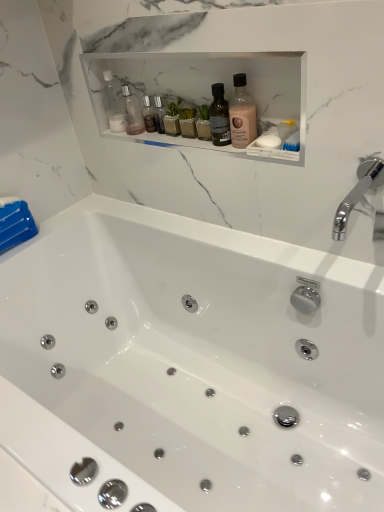
Where is `pink matte bottle at center, the 1th bottle viewed from the front`? The width and height of the screenshot is (384, 512). pink matte bottle at center, the 1th bottle viewed from the front is located at coordinates (242, 114).

Describe the element at coordinates (113, 104) in the screenshot. I see `transparent plastic bottle at upper center, acting as the first bottle starting from the left` at that location.

The height and width of the screenshot is (512, 384). In order to click on white matte soap at right in this screenshot , I will do `click(268, 141)`.

The height and width of the screenshot is (512, 384). I want to click on white glossy bathtub at center, so click(190, 366).

The image size is (384, 512). Identify the location of pink matte bottle at center, the first bottle in the right-to-left sequence. (242, 114).

From the image's perspective, does white matte soap at right appear lower than white glossy bathtub at center?

No, from the image's perspective, white matte soap at right is not beneath white glossy bathtub at center.

Does white matte soap at right have a greater height compared to white glossy bathtub at center?

Incorrect, the height of white matte soap at right is not larger of that of white glossy bathtub at center.

Considering the positions of objects white matte soap at right and white glossy bathtub at center in the image provided, who is more to the right, white matte soap at right or white glossy bathtub at center?

From the viewer's perspective, white matte soap at right appears more on the right side.

Is white matte soap at right wider or thinner than white glossy bathtub at center?

Considering their sizes, white matte soap at right looks slimmer than white glossy bathtub at center.

From the image's perspective, which one is positioned higher, white matte soap at right or transparent plastic bottle at upper center, which ranks as the 3th bottle in right-to-left order?

From the image's view, transparent plastic bottle at upper center, which ranks as the 3th bottle in right-to-left order, is above.

Is white matte soap at right bigger or smaller than transparent plastic bottle at upper center, acting as the first bottle starting from the left?

Considering their sizes, white matte soap at right takes up less space than transparent plastic bottle at upper center, acting as the first bottle starting from the left.

Is there a large distance between white matte soap at right and transparent plastic bottle at upper center, acting as the first bottle starting from the left?

white matte soap at right is actually quite close to transparent plastic bottle at upper center, acting as the first bottle starting from the left.

Which object is positioned more to the left, white matte soap at right or transparent plastic bottle at upper center, which ranks as the second bottle in back-to-front order?

From the viewer's perspective, transparent plastic bottle at upper center, which ranks as the second bottle in back-to-front order, appears more on the left side.

Is transparent plastic bottle at upper center, acting as the first bottle starting from the left, surrounding white matte soap at right?

No, white matte soap at right is not a part of transparent plastic bottle at upper center, acting as the first bottle starting from the left.

Between point (112, 79) and point (265, 144), which one is positioned behind?

The point (112, 79) is more distant.

Between transparent plastic bottle at upper center, which ranks as the second bottle in back-to-front order, and white matte soap at right, which one appears on the left side from the viewer's perspective?

From the viewer's perspective, transparent plastic bottle at upper center, which ranks as the second bottle in back-to-front order, appears more on the left side.

From the image's perspective, which object appears higher, white glossy bathtub at center or chrome metallic faucet at upper right?

chrome metallic faucet at upper right.

How many degrees apart are the facing directions of white glossy bathtub at center and chrome metallic faucet at upper right?

The angular difference between white glossy bathtub at center and chrome metallic faucet at upper right is 0.741 degrees.

Is white glossy bathtub at center with chrome metallic faucet at upper right?

No, white glossy bathtub at center is not next to chrome metallic faucet at upper right.

From a real-world perspective, is white glossy bathtub at center under chrome metallic faucet at upper right?

Yes.

How distant is chrome metallic faucet at upper right from transparent plastic bottle at upper center, which ranks as the second bottle in back-to-front order?

chrome metallic faucet at upper right and transparent plastic bottle at upper center, which ranks as the second bottle in back-to-front order, are 30.01 inches apart.

Is chrome metallic faucet at upper right in front of transparent plastic bottle at upper center, acting as the second bottle starting from the front?

Yes, chrome metallic faucet at upper right is closer to the camera.

Which is more to the right, chrome metallic faucet at upper right or transparent plastic bottle at upper center, which ranks as the 3th bottle in right-to-left order?

Positioned to the right is chrome metallic faucet at upper right.

Which is in front, point (357, 199) or point (115, 112)?

The point (357, 199) is closer to the camera.

Which bottle is the 1st one when counting from the left side of the white glossy bathtub at center? Please provide its 2D coordinates.

[(132, 112)]

Is transparent plastic bottle at upper center, marked as the 3th bottle in a front-to-back arrangement, situated inside white glossy bathtub at center or outside?

transparent plastic bottle at upper center, marked as the 3th bottle in a front-to-back arrangement, is not inside white glossy bathtub at center, it's outside.

From the image's perspective, between transparent plastic bottle at upper center, the 2th bottle positioned from the right, and white glossy bathtub at center, which one is located above?

transparent plastic bottle at upper center, the 2th bottle positioned from the right, from the image's perspective.

From a real-world perspective, is transparent plastic bottle at upper center, which is the 1th bottle in back-to-front order, on top of white glossy bathtub at center?

Correct, in the physical world, transparent plastic bottle at upper center, which is the 1th bottle in back-to-front order, is higher than white glossy bathtub at center.

Is point (141, 131) closer or farther from the camera than point (356, 198)?

Point (141, 131) appears to be farther away from the viewer than point (356, 198).

Is transparent plastic bottle at upper center, which is the 1th bottle in back-to-front order, aimed at chrome metallic faucet at upper right?

No, transparent plastic bottle at upper center, which is the 1th bottle in back-to-front order, is not turned towards chrome metallic faucet at upper right.

In the image, is transparent plastic bottle at upper center, marked as the 3th bottle in a front-to-back arrangement, positioned in front of or behind chrome metallic faucet at upper right?

transparent plastic bottle at upper center, marked as the 3th bottle in a front-to-back arrangement, is behind chrome metallic faucet at upper right.

Who is shorter, transparent plastic bottle at upper center, which is the 1th bottle in back-to-front order, or chrome metallic faucet at upper right?

chrome metallic faucet at upper right.

At what (x,y) coordinates should I click in order to perform the action: click on soap above the white glossy bathtub at center (from a real-world perspective). Please return your answer as a coordinate pair (x, y). Image resolution: width=384 pixels, height=512 pixels. Looking at the image, I should click on (268, 141).

From the image's perspective, count 3rd bottles upward from the white matte soap at right and point to it. Please provide its 2D coordinates.

[(113, 104)]

From the image, which object appears to be farther from white matte soap at right, transparent plastic bottle at upper center, marked as the 3th bottle in a front-to-back arrangement, or white glossy bathtub at center?

Based on the image, white glossy bathtub at center appears to be further to white matte soap at right.

From the image, which object appears to be nearer to transparent plastic bottle at upper center, which ranks as the second bottle in back-to-front order, pink matte bottle at center, the first bottle in the right-to-left sequence, or white glossy bathtub at center?

pink matte bottle at center, the first bottle in the right-to-left sequence, is closer to transparent plastic bottle at upper center, which ranks as the second bottle in back-to-front order.

Estimate the real-world distances between objects in this image. Which object is further from pink matte bottle at center, the first bottle in the right-to-left sequence, white glossy bathtub at center or chrome metallic faucet at upper right?

white glossy bathtub at center lies further to pink matte bottle at center, the first bottle in the right-to-left sequence, than the other object.

Based on their spatial positions, is chrome metallic faucet at upper right or white matte soap at right further from transparent plastic bottle at upper center, which ranks as the 3th bottle in right-to-left order?

chrome metallic faucet at upper right.

Looking at this image, looking at the image, which one is located further to chrome metallic faucet at upper right, transparent plastic bottle at upper center, acting as the first bottle starting from the left, or pink matte bottle at center, the first bottle in the right-to-left sequence?

The object further to chrome metallic faucet at upper right is transparent plastic bottle at upper center, acting as the first bottle starting from the left.

Based on their spatial positions, is pink matte bottle at center, the 1th bottle viewed from the front, or white matte soap at right further from white glossy bathtub at center?

Based on the image, white matte soap at right appears to be further to white glossy bathtub at center.

Considering their positions, is pink matte bottle at center, which is the third bottle in back-to-front order, positioned further to transparent plastic bottle at upper center, the 2th bottle positioned from the right, than chrome metallic faucet at upper right?

chrome metallic faucet at upper right is further to transparent plastic bottle at upper center, the 2th bottle positioned from the right.

When comparing their distances from white glossy bathtub at center, does transparent plastic bottle at upper center, positioned as the second bottle in left-to-right order, or chrome metallic faucet at upper right seem closer?

chrome metallic faucet at upper right is positioned closer to the anchor white glossy bathtub at center.

The height and width of the screenshot is (512, 384). Find the location of `bottle between transparent plastic bottle at upper center, which ranks as the 3th bottle in right-to-left order, and pink matte bottle at center, arranged as the 3th bottle when viewed from the left`. bottle between transparent plastic bottle at upper center, which ranks as the 3th bottle in right-to-left order, and pink matte bottle at center, arranged as the 3th bottle when viewed from the left is located at coordinates (132, 112).

You are a GUI agent. You are given a task and a screenshot of the screen. Output one action in this format:
    pyautogui.click(x=<x>, y=<y>)
    Task: Click on the soap between transparent plastic bottle at upper center, marked as the 3th bottle in a front-to-back arrangement, and white glossy bathtub at center vertically
    This screenshot has height=512, width=384.
    Given the screenshot: What is the action you would take?
    pos(268,141)

Find the location of a particular element. This screenshot has height=512, width=384. soap between transparent plastic bottle at upper center, which ranks as the second bottle in back-to-front order, and white glossy bathtub at center, in the vertical direction is located at coordinates (268, 141).

Where is `bottle situated between transparent plastic bottle at upper center, positioned as the second bottle in left-to-right order, and chrome metallic faucet at upper right from left to right`? The image size is (384, 512). bottle situated between transparent plastic bottle at upper center, positioned as the second bottle in left-to-right order, and chrome metallic faucet at upper right from left to right is located at coordinates (242, 114).